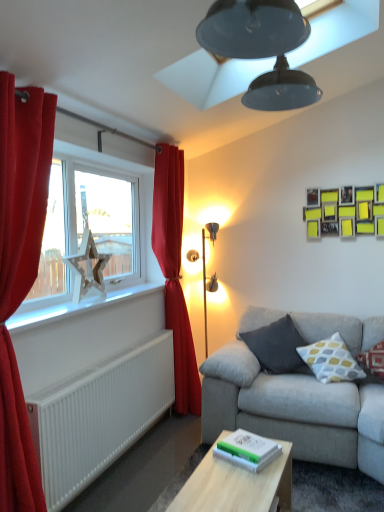
Question: Considering the positions of light wood rectangular table at center and white plastic window sill at left in the image, is light wood rectangular table at center bigger or smaller than white plastic window sill at left?

Choices:
 (A) big
 (B) small

Answer: (A)

Question: From the image's perspective, relative to white plastic window sill at left, is light wood rectangular table at center above or below?

Choices:
 (A) above
 (B) below

Answer: (B)

Question: Estimate the real-world distances between objects in this image. Which object is farther from the light wood rectangular table at center?

Choices:
 (A) red velvet curtain at left, positioned as the 2th curtain in left-to-right order
 (B) yellow-grey dotted cushion at right, the second pillow from the left
 (C) red cotton cushion at right, positioned as the 3th pillow in left-to-right order
 (D) white textured radiator at lower left
 (E) wooden star at left

Answer: (E)

Question: Which object is positioned closest to the white plastic window sill at left?

Choices:
 (A) red velvet curtain at left, positioned as the second curtain in front-to-back order
 (B) red cotton cushion at right, positioned as the 3th pillow in left-to-right order
 (C) yellow-grey dotted cushion at right, the second pillow from the left
 (D) light wood rectangular table at center
 (E) gold metallic floor lamp at center

Answer: (A)